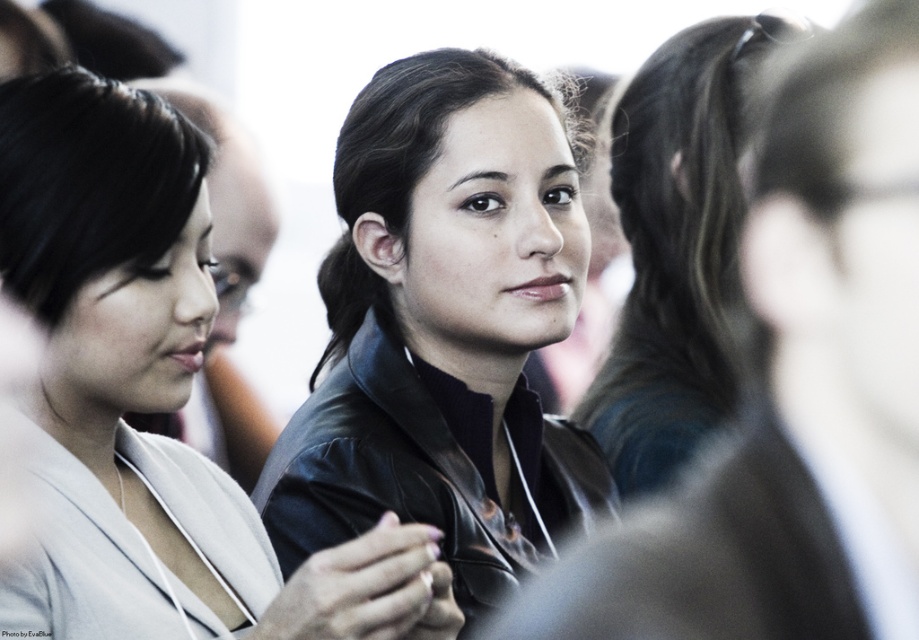
You are at a networking event and need to approach the person wearing the matte black jacket at center and the person with dark brown hair at center. Which one should you walk towards if you want to greet the person on the left side of the group?

You should walk towards the matte black jacket at center because it is located to the left of dark brown hair at center, making it the leftmost object in the group.

You are organizing a clothing display and need to arrange the matte black jacket at center and the black leather jacket at center based on their positions in the image. Which jacket is positioned to the left of the other?

The matte black jacket at center is to the right of the black leather jacket at center, so the black leather jacket at center is positioned to the left of the matte black jacket at center.